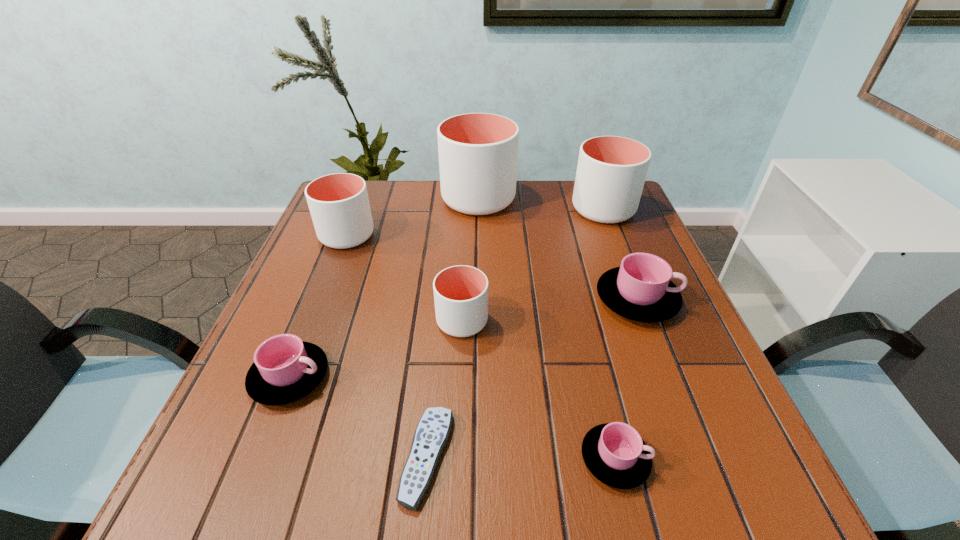
Identify the location of unoccupied position between the nearest white cup and the third biggest white cup. This screenshot has height=540, width=960. (404, 278).

You are a GUI agent. You are given a task and a screenshot of the screen. Output one action in this format:
    pyautogui.click(x=<x>, y=<y>)
    Task: Click on the fourth closest object relative to the smallest white cup
    This screenshot has width=960, height=540.
    Given the screenshot: What is the action you would take?
    (x=640, y=289)

Locate an element on the screen. object that is the second closest to the second smallest white cup is located at coordinates (460, 292).

Choose which cup is the third nearest neighbor to the fourth tallest cup. Please provide its 2D coordinates. Your answer should be formatted as a tuple, i.e. [(x, y)], where the tuple contains the x and y coordinates of a point satisfying the conditions above.

[(640, 289)]

You are a GUI agent. You are given a task and a screenshot of the screen. Output one action in this format:
    pyautogui.click(x=<x>, y=<y>)
    Task: Click on the cup identified as the second closest to the biggest white cup
    This screenshot has height=540, width=960.
    Given the screenshot: What is the action you would take?
    pyautogui.click(x=339, y=205)

Select which white cup is the closest to the sixth shortest object. Please provide its 2D coordinates. Your answer should be formatted as a tuple, i.e. [(x, y)], where the tuple contains the x and y coordinates of a point satisfying the conditions above.

[(478, 152)]

Select which white cup appears as the closest to the second nearest pink cup. Please provide its 2D coordinates. Your answer should be formatted as a tuple, i.e. [(x, y)], where the tuple contains the x and y coordinates of a point satisfying the conditions above.

[(460, 292)]

Locate which pink cup ranks second in proximity to the tallest cup. Please provide its 2D coordinates. Your answer should be formatted as a tuple, i.e. [(x, y)], where the tuple contains the x and y coordinates of a point satisfying the conditions above.

[(285, 369)]

Choose which pink cup is the nearest neighbor to the nearest white cup. Please provide its 2D coordinates. Your answer should be formatted as a tuple, i.e. [(x, y)], where the tuple contains the x and y coordinates of a point satisfying the conditions above.

[(285, 369)]

Identify the location of free space that satisfies the following two spatial constraints: 1. on the front side of the leftmost white cup; 2. on the side with the handle of the second farthest pink cup. Image resolution: width=960 pixels, height=540 pixels. (292, 377).